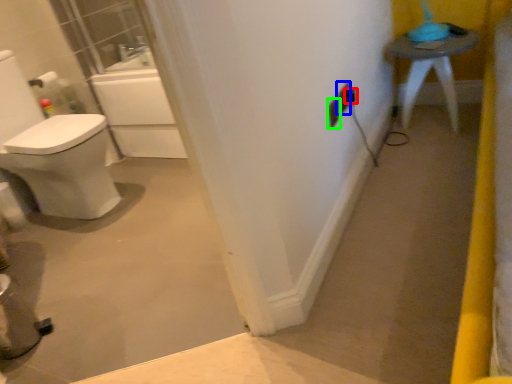
Question: Which object is positioned closest to electric outlet (highlighted by a red box)? Select from electric outlet (highlighted by a blue box) and electric outlet (highlighted by a green box).

Choices:
 (A) electric outlet
 (B) electric outlet

Answer: (A)